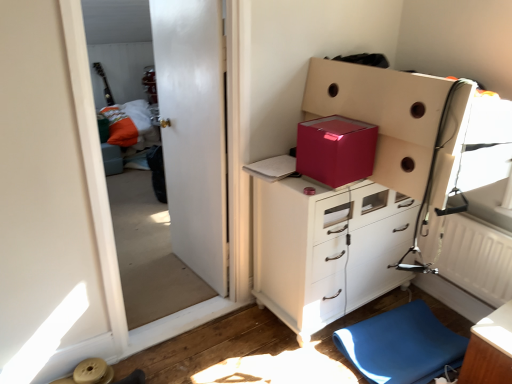
Question: Are blue rubber mat at lower right and matte white cabinet at center making contact?

Choices:
 (A) yes
 (B) no

Answer: (B)

Question: Does blue rubber mat at lower right have a lesser width compared to matte white cabinet at center?

Choices:
 (A) yes
 (B) no

Answer: (B)

Question: Does blue rubber mat at lower right come in front of matte white cabinet at center?

Choices:
 (A) yes
 (B) no

Answer: (B)

Question: Can you confirm if blue rubber mat at lower right is positioned to the right of matte white cabinet at center?

Choices:
 (A) no
 (B) yes

Answer: (B)

Question: Is blue rubber mat at lower right to the left of matte white cabinet at center from the viewer's perspective?

Choices:
 (A) no
 (B) yes

Answer: (A)

Question: In the image, is white textured radiator at lower right positioned in front of or behind orange fabric bed at left?

Choices:
 (A) front
 (B) behind

Answer: (A)

Question: From the image's perspective, is white textured radiator at lower right above or below orange fabric bed at left?

Choices:
 (A) below
 (B) above

Answer: (A)

Question: Looking at the image, does white textured radiator at lower right seem bigger or smaller compared to orange fabric bed at left?

Choices:
 (A) big
 (B) small

Answer: (B)

Question: Considering the relative positions of white textured radiator at lower right and orange fabric bed at left in the image provided, is white textured radiator at lower right to the left or to the right of orange fabric bed at left?

Choices:
 (A) left
 (B) right

Answer: (B)

Question: Is point (352, 337) positioned closer to the camera than point (317, 96)?

Choices:
 (A) closer
 (B) farther

Answer: (B)

Question: Looking at the image, does blue rubber mat at lower right seem bigger or smaller compared to matte pink cardboard box at upper right, marked as the first cardboard box in a right-to-left arrangement?

Choices:
 (A) big
 (B) small

Answer: (B)

Question: In terms of width, does blue rubber mat at lower right look wider or thinner when compared to matte pink cardboard box at upper right, placed as the second cardboard box when sorted from left to right?

Choices:
 (A) thin
 (B) wide

Answer: (A)

Question: Considering the relative positions of blue rubber mat at lower right and matte pink cardboard box at upper right, marked as the first cardboard box in a right-to-left arrangement, in the image provided, is blue rubber mat at lower right to the left or to the right of matte pink cardboard box at upper right, marked as the first cardboard box in a right-to-left arrangement,?

Choices:
 (A) right
 (B) left

Answer: (A)

Question: From a real-world perspective, relative to matte white cabinet at center, is white glossy door at upper left vertically above or below?

Choices:
 (A) below
 (B) above

Answer: (B)

Question: From the image's perspective, is white glossy door at upper left located above or below matte white cabinet at center?

Choices:
 (A) below
 (B) above

Answer: (B)